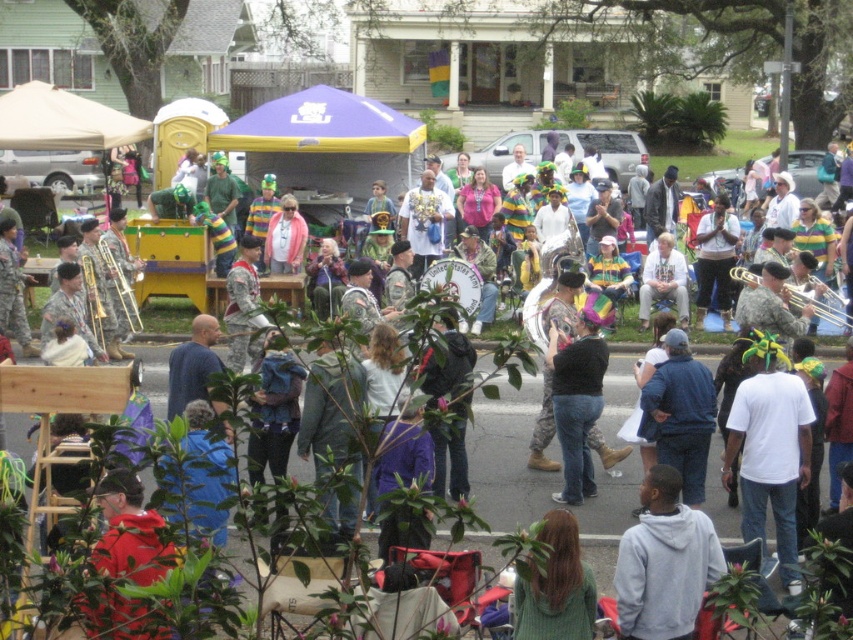
Question: Which point is farther to the camera?

Choices:
 (A) black matte shirt at center
 (B) gray hoodie at lower center
 (C) white cotton shirt at center

Answer: (A)

Question: Is gray hoodie at lower center below black matte shirt at center?

Choices:
 (A) yes
 (B) no

Answer: (A)

Question: Estimate the real-world distances between objects in this image. Which object is closer to the gray hoodie at lower center?

Choices:
 (A) black matte shirt at center
 (B) white cotton shirt at center

Answer: (B)

Question: Can you confirm if white cotton shirt at center is wider than black matte shirt at center?

Choices:
 (A) no
 (B) yes

Answer: (B)

Question: Which point is closer to the camera?

Choices:
 (A) (775, 440)
 (B) (589, 372)
 (C) (648, 593)

Answer: (C)

Question: Observing the image, what is the correct spatial positioning of white cotton shirt at center in reference to gray hoodie at lower center?

Choices:
 (A) below
 (B) above

Answer: (B)